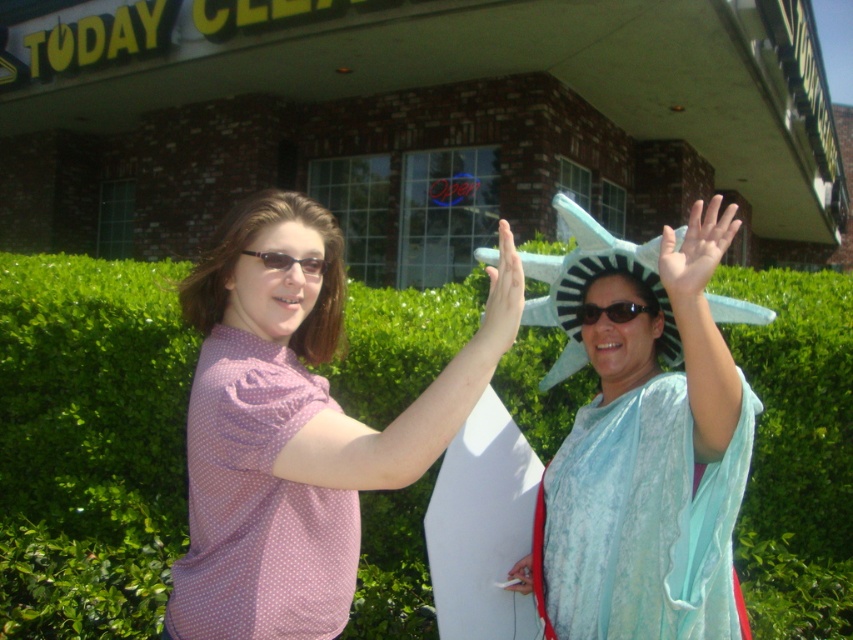
Can you confirm if green leafy hedge at center is positioned below pink polka dot shirt at center?

Yes.

Does green leafy hedge at center lie behind pink polka dot shirt at center?

Yes.

Locate an element on the screen. The width and height of the screenshot is (853, 640). green leafy hedge at center is located at coordinates (90, 444).

Is point (207, 630) positioned in front of point (683, 308)?

No, (207, 630) is further to viewer.

Describe the element at coordinates (294, 428) in the screenshot. I see `pink polka dot shirt at center` at that location.

The height and width of the screenshot is (640, 853). Identify the location of pink polka dot shirt at center. (294, 428).

Where is `pink polka dot shirt at center`? Image resolution: width=853 pixels, height=640 pixels. pink polka dot shirt at center is located at coordinates (294, 428).

How much distance is there between black plastic sunglasses at center and matte black sunglasses at center?

black plastic sunglasses at center and matte black sunglasses at center are 27.41 inches apart.

In the scene shown: Can you confirm if black plastic sunglasses at center is shorter than matte black sunglasses at center?

Incorrect, black plastic sunglasses at center's height does not fall short of matte black sunglasses at center's.

Which is in front, point (608, 305) or point (303, 264)?

Point (303, 264) is more forward.

Where is `black plastic sunglasses at center`? black plastic sunglasses at center is located at coordinates (614, 310).